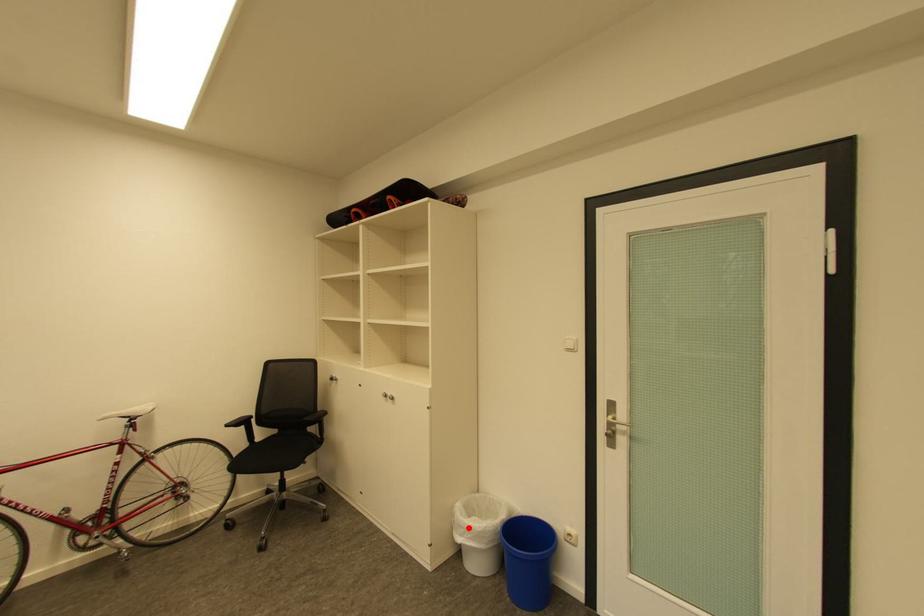
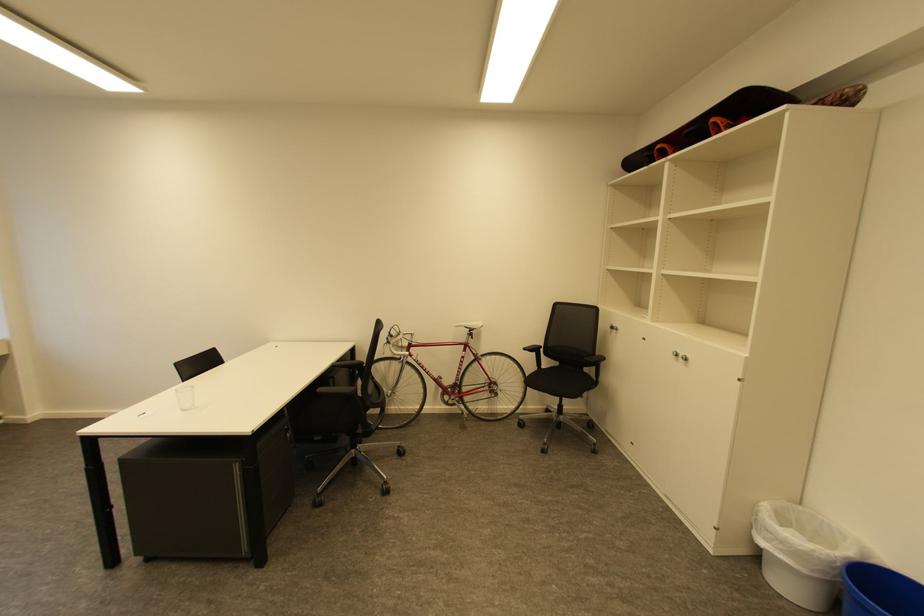
Question: I am providing you with two images of the same scene from different viewpoints. In image1, a red point is highlighted. Considering the same 3D point in image2, which of the following is correct?

Choices:
 (A) It is closer
 (B) It is farther

Answer: (A)